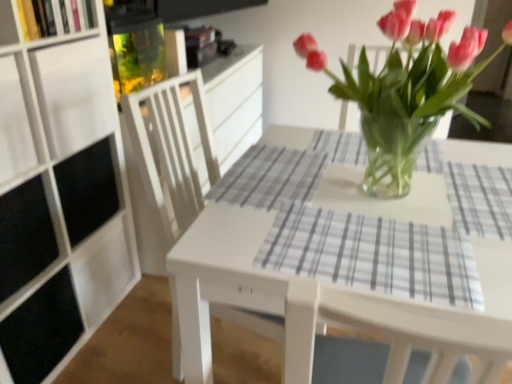
I want to click on empty space that is ontop of white glossy table at center (from a real-world perspective), so click(379, 191).